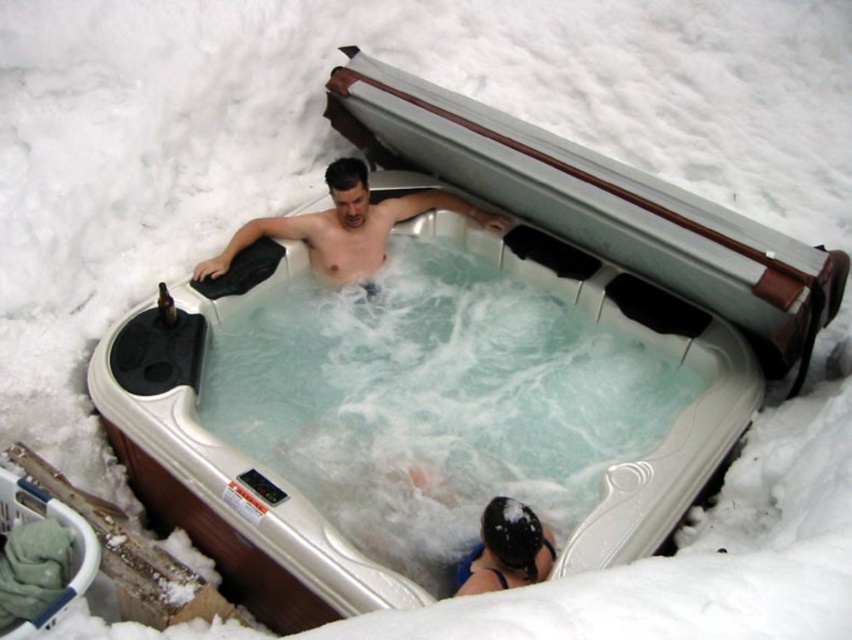
Question: Can you confirm if clear plastic water at center is positioned above shiny silver tub at center?

Choices:
 (A) no
 (B) yes

Answer: (A)

Question: Does clear plastic water at center have a greater width compared to shiny silver tub at center?

Choices:
 (A) yes
 (B) no

Answer: (A)

Question: Does clear plastic water at center lie behind shiny silver tub at center?

Choices:
 (A) no
 (B) yes

Answer: (A)